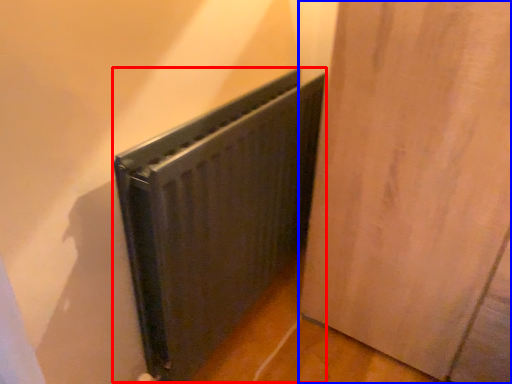
Question: Which point is closer to the camera, radiator (highlighted by a red box) or door (highlighted by a blue box)?

Choices:
 (A) radiator
 (B) door

Answer: (B)